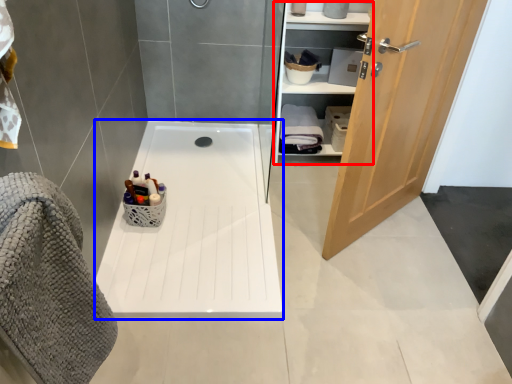
Question: Which object is closer to the camera taking this photo, closet (highlighted by a red box) or bath (highlighted by a blue box)?

Choices:
 (A) closet
 (B) bath

Answer: (B)